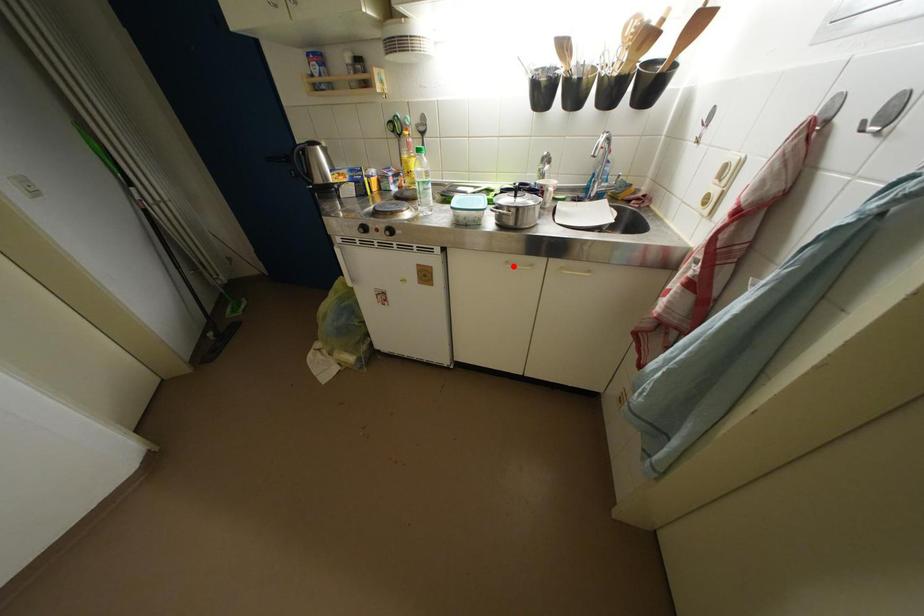
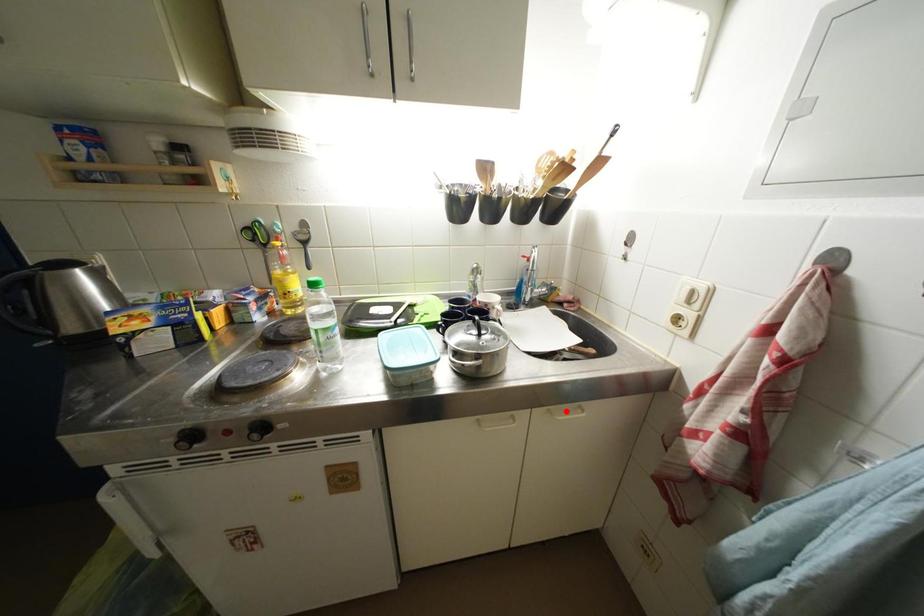
I am providing you with two images of the same scene from different viewpoints. A red point is marked on the first image and another point is marked on the second image. Is the red point in image1 aligned with the point shown in image2?

No